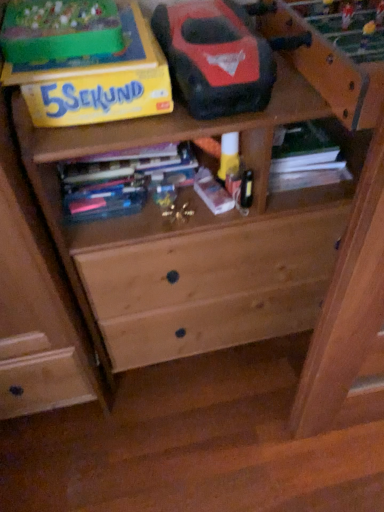
You are a GUI agent. You are given a task and a screenshot of the screen. Output one action in this format:
    pyautogui.click(x=<x>, y=<y>)
    Task: Click on the matte plastic book at center, placed as the second book when sorted from left to right
    
    Given the screenshot: What is the action you would take?
    pyautogui.click(x=212, y=192)

At what (x,y) coordinates should I click in order to perform the action: click on green matte book at upper right, which is the third book in left-to-right order. Please return your answer as a coordinate pair (x, y). The width and height of the screenshot is (384, 512). Looking at the image, I should click on (306, 158).

From the picture: Who is smaller, multicolored paperbacks at center, which is the 1th book in left-to-right order, or yellow cardboard box at upper left?

multicolored paperbacks at center, which is the 1th book in left-to-right order.

Does multicolored paperbacks at center, which is the 1th book in left-to-right order, appear on the right side of yellow cardboard box at upper left?

Correct, you'll find multicolored paperbacks at center, which is the 1th book in left-to-right order, to the right of yellow cardboard box at upper left.

From the image's perspective, starting from the yellow cardboard box at upper left, which book is the 2nd one below? Please provide its 2D coordinates.

[(124, 181)]

Which object is thinner, matte plastic book at center, the second book from the right, or multicolored paperbacks at center, placed as the third book when sorted from right to left?

multicolored paperbacks at center, placed as the third book when sorted from right to left.

Is point (231, 199) closer to viewer compared to point (113, 203)?

Yes.

Is matte plastic book at center, the second book from the right, not near multicolored paperbacks at center, which is the 1th book in left-to-right order?

No, matte plastic book at center, the second book from the right, is in close proximity to multicolored paperbacks at center, which is the 1th book in left-to-right order.

Is matte plastic book at center, the second book from the right, shorter than multicolored paperbacks at center, which is the 1th book in left-to-right order?

Yes, matte plastic book at center, the second book from the right, is shorter than multicolored paperbacks at center, which is the 1th book in left-to-right order.

Where is `the 1st book below the yellow cardboard box at upper left (from the image's perspective)`? the 1st book below the yellow cardboard box at upper left (from the image's perspective) is located at coordinates (306, 158).

From the image's perspective, does yellow cardboard box at upper left appear lower than green matte book at upper right, the 1th book positioned from the right?

No, from the image's perspective, yellow cardboard box at upper left is not beneath green matte book at upper right, the 1th book positioned from the right.

From the picture: Is yellow cardboard box at upper left aimed at green matte book at upper right, which is the third book in left-to-right order?

No, yellow cardboard box at upper left is not oriented towards green matte book at upper right, which is the third book in left-to-right order.

Which is more to the right, green matte book at upper right, which is the third book in left-to-right order, or matte plastic book at center, placed as the second book when sorted from left to right?

From the viewer's perspective, green matte book at upper right, which is the third book in left-to-right order, appears more on the right side.

From a real-world perspective, which is physically above, green matte book at upper right, the 1th book positioned from the right, or matte plastic book at center, placed as the second book when sorted from left to right?

matte plastic book at center, placed as the second book when sorted from left to right.

How many degrees apart are the facing directions of green matte book at upper right, which is the third book in left-to-right order, and matte plastic book at center, placed as the second book when sorted from left to right?

The angle between the facing direction of green matte book at upper right, which is the third book in left-to-right order, and the facing direction of matte plastic book at center, placed as the second book when sorted from left to right, is 20.1 degrees.

Is multicolored paperbacks at center, placed as the third book when sorted from right to left, inside the boundaries of green matte book at upper right, the 1th book positioned from the right, or outside?

multicolored paperbacks at center, placed as the third book when sorted from right to left, exists outside the volume of green matte book at upper right, the 1th book positioned from the right.

Which is more to the left, multicolored paperbacks at center, placed as the third book when sorted from right to left, or green matte book at upper right, the 1th book positioned from the right?

multicolored paperbacks at center, placed as the third book when sorted from right to left.

Which point is more distant from viewer, (x=113, y=215) or (x=302, y=163)?

Point (x=302, y=163)

Would you say matte plastic book at center, placed as the second book when sorted from left to right, is outside yellow cardboard box at upper left?

Yes, matte plastic book at center, placed as the second book when sorted from left to right, is located beyond the bounds of yellow cardboard box at upper left.

From the picture: Is matte plastic book at center, placed as the second book when sorted from left to right, facing towards yellow cardboard box at upper left?

No, matte plastic book at center, placed as the second book when sorted from left to right, is not turned towards yellow cardboard box at upper left.

Can you confirm if matte plastic book at center, the second book from the right, is thinner than yellow cardboard box at upper left?

Correct, the width of matte plastic book at center, the second book from the right, is less than that of yellow cardboard box at upper left.

How distant is matte plastic book at center, placed as the second book when sorted from left to right, from yellow cardboard box at upper left?

12.98 inches.

Based on the photo, would you consider green matte book at upper right, the 1th book positioned from the right, to be distant from multicolored paperbacks at center, which is the 1th book in left-to-right order?

No, green matte book at upper right, the 1th book positioned from the right, is not far from multicolored paperbacks at center, which is the 1th book in left-to-right order.

From a real-world perspective, which is physically below, green matte book at upper right, the 1th book positioned from the right, or multicolored paperbacks at center, placed as the third book when sorted from right to left?

green matte book at upper right, the 1th book positioned from the right.

Which of these two, green matte book at upper right, the 1th book positioned from the right, or multicolored paperbacks at center, placed as the third book when sorted from right to left, is wider?

green matte book at upper right, the 1th book positioned from the right.

You are a GUI agent. You are given a task and a screenshot of the screen. Output one action in this format:
    pyautogui.click(x=<x>, y=<y>)
    Task: Click on the 2nd book below the yellow cardboard box at upper left (from the image's perspective)
    The width and height of the screenshot is (384, 512).
    Given the screenshot: What is the action you would take?
    pyautogui.click(x=124, y=181)

Where is `book that appears in front of the multicolored paperbacks at center, placed as the third book when sorted from right to left`? The image size is (384, 512). book that appears in front of the multicolored paperbacks at center, placed as the third book when sorted from right to left is located at coordinates (212, 192).

Based on their spatial positions, is green matte book at upper right, the 1th book positioned from the right, or multicolored paperbacks at center, placed as the third book when sorted from right to left, further from yellow cardboard box at upper left?

green matte book at upper right, the 1th book positioned from the right, is further to yellow cardboard box at upper left.

Consider the image. Estimate the real-world distances between objects in this image. Which object is closer to multicolored paperbacks at center, which is the 1th book in left-to-right order, green matte book at upper right, which is the third book in left-to-right order, or yellow cardboard box at upper left?

yellow cardboard box at upper left is positioned closer to the anchor multicolored paperbacks at center, which is the 1th book in left-to-right order.

Based on their spatial positions, is green matte book at upper right, the 1th book positioned from the right, or matte plastic book at center, placed as the second book when sorted from left to right, further from yellow cardboard box at upper left?

green matte book at upper right, the 1th book positioned from the right, is positioned further to the anchor yellow cardboard box at upper left.

From the image, which object appears to be nearer to matte plastic book at center, the second book from the right, multicolored paperbacks at center, which is the 1th book in left-to-right order, or green matte book at upper right, which is the third book in left-to-right order?

multicolored paperbacks at center, which is the 1th book in left-to-right order, lies closer to matte plastic book at center, the second book from the right, than the other object.

Which object lies further to the anchor point yellow cardboard box at upper left, matte plastic book at center, the second book from the right, or multicolored paperbacks at center, placed as the third book when sorted from right to left?

matte plastic book at center, the second book from the right, is positioned further to the anchor yellow cardboard box at upper left.

Considering their positions, is yellow cardboard box at upper left positioned further to green matte book at upper right, the 1th book positioned from the right, than multicolored paperbacks at center, which is the 1th book in left-to-right order?

yellow cardboard box at upper left is further to green matte book at upper right, the 1th book positioned from the right.

From the image, which object appears to be farther from matte plastic book at center, placed as the second book when sorted from left to right, yellow cardboard box at upper left or multicolored paperbacks at center, placed as the third book when sorted from right to left?

yellow cardboard box at upper left.

Based on their spatial positions, is multicolored paperbacks at center, which is the 1th book in left-to-right order, or matte plastic book at center, placed as the second book when sorted from left to right, closer to yellow cardboard box at upper left?

The object closer to yellow cardboard box at upper left is multicolored paperbacks at center, which is the 1th book in left-to-right order.

Find the location of a particular element. book located between multicolored paperbacks at center, placed as the third book when sorted from right to left, and green matte book at upper right, the 1th book positioned from the right, in the left-right direction is located at coordinates (212, 192).

I want to click on book between yellow cardboard box at upper left and multicolored paperbacks at center, which is the 1th book in left-to-right order, in the front-back direction, so click(212, 192).